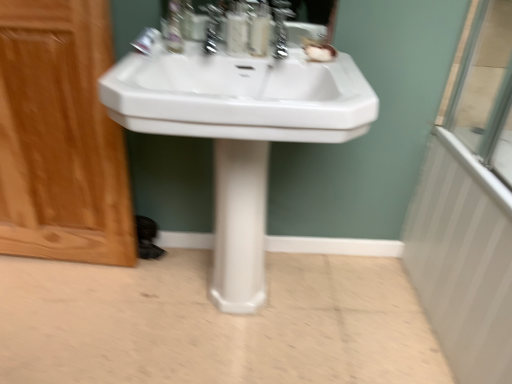
Question: Based on their sizes in the image, would you say clear plastic bottle at upper center is bigger or smaller than white glossy sink at center?

Choices:
 (A) small
 (B) big

Answer: (A)

Question: Is clear plastic bottle at upper center in front of or behind white glossy sink at center in the image?

Choices:
 (A) behind
 (B) front

Answer: (A)

Question: Considering the real-world distances, which object is closest to the translucent plastic soap dispenser at upper center, positioned as the first soap dispenser in right-to-left order?

Choices:
 (A) satin nickel faucet at upper center, which is the first faucet in right-to-left order
 (B) white glossy pedestal at center
 (C) white textured radiator at right
 (D) polished chrome faucet at upper center, which is the second faucet in right-to-left order
 (E) wooden screen door at left

Answer: (A)

Question: Based on their relative distances, which object is nearer to the polished chrome faucet at upper center, marked as the 1th faucet in a left-to-right arrangement?

Choices:
 (A) white glossy sink at center
 (B) translucent plastic soap dispenser at upper center, positioned as the first soap dispenser in right-to-left order
 (C) wooden screen door at left
 (D) white textured radiator at right
 (E) clear plastic bottle at upper center

Answer: (E)